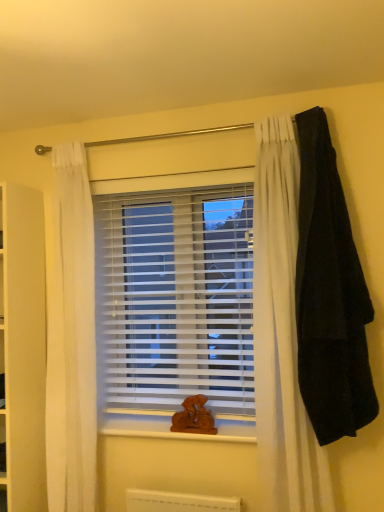
Question: Is wooden at center behind white plastic blinds at center?

Choices:
 (A) no
 (B) yes

Answer: (A)

Question: Is wooden at center in front of white plastic blinds at center?

Choices:
 (A) no
 (B) yes

Answer: (B)

Question: Does wooden at center appear on the right side of white plastic blinds at center?

Choices:
 (A) no
 (B) yes

Answer: (A)

Question: Is wooden at center beside white plastic blinds at center?

Choices:
 (A) no
 (B) yes

Answer: (A)

Question: From a real-world perspective, does wooden at center sit lower than white plastic blinds at center?

Choices:
 (A) no
 (B) yes

Answer: (B)

Question: In the image, is white plastic blinds at center positioned in front of or behind black woolen blanket at right?

Choices:
 (A) front
 (B) behind

Answer: (B)

Question: Is white plastic blinds at center situated inside black woolen blanket at right or outside?

Choices:
 (A) inside
 (B) outside

Answer: (B)

Question: Is white plastic blinds at center wider or thinner than black woolen blanket at right?

Choices:
 (A) wide
 (B) thin

Answer: (B)

Question: Is point (210, 331) closer or farther from the camera than point (314, 394)?

Choices:
 (A) farther
 (B) closer

Answer: (A)

Question: Visually, is black woolen blanket at right positioned to the left or to the right of white plastic blinds at center?

Choices:
 (A) right
 (B) left

Answer: (A)

Question: Based on their sizes in the image, would you say black woolen blanket at right is bigger or smaller than white plastic blinds at center?

Choices:
 (A) small
 (B) big

Answer: (B)

Question: From the image's perspective, relative to white plastic blinds at center, is black woolen blanket at right above or below?

Choices:
 (A) below
 (B) above

Answer: (B)

Question: Does point (302, 335) appear closer or farther from the camera than point (198, 216)?

Choices:
 (A) closer
 (B) farther

Answer: (A)

Question: From the image's perspective, is black woolen blanket at right located above or below wooden at center?

Choices:
 (A) above
 (B) below

Answer: (A)

Question: Based on their sizes in the image, would you say black woolen blanket at right is bigger or smaller than wooden at center?

Choices:
 (A) small
 (B) big

Answer: (B)